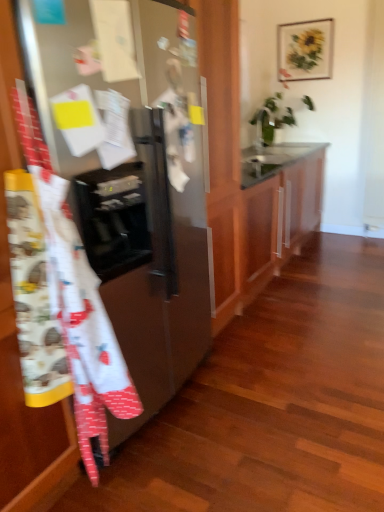
Question: Does point (276, 224) appear closer or farther from the camera than point (61, 293)?

Choices:
 (A) closer
 (B) farther

Answer: (B)

Question: Considering their positions, is glossy wood cabinet at center located in front of or behind white cotton apron at left?

Choices:
 (A) behind
 (B) front

Answer: (A)

Question: Which of these objects is positioned closest to the satin silver refrigerator at left?

Choices:
 (A) glossy wood cabinet at center
 (B) white glossy sink at upper center
 (C) white cotton apron at left

Answer: (C)

Question: Which of these objects is positioned closest to the satin silver refrigerator at left?

Choices:
 (A) glossy wood cabinet at center
 (B) white glossy sink at upper center
 (C) white cotton apron at left

Answer: (C)